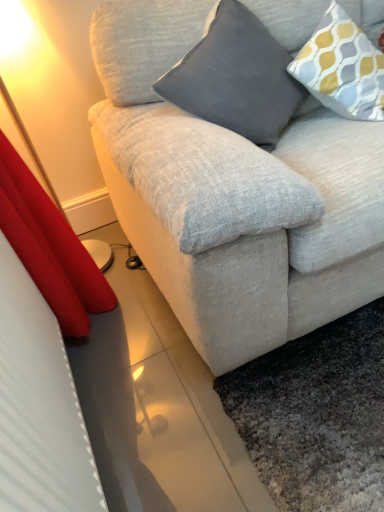
This screenshot has height=512, width=384. What do you see at coordinates (236, 77) in the screenshot?
I see `gray fabric pillow at upper center, which is the 2th pillow in right-to-left order` at bounding box center [236, 77].

Find the location of a particular element. The width and height of the screenshot is (384, 512). gray fabric pillow at upper center, positioned as the 1th pillow in left-to-right order is located at coordinates (236, 77).

In order to face gray fabric pillow at upper center, which is the 2th pillow in right-to-left order, should I rotate leftwards or rightwards?

It's best to rotate right around 5.206 degrees.

What is the approximate height of patterned fabric pillow at upper right, the 2th pillow positioned from the left?

patterned fabric pillow at upper right, the 2th pillow positioned from the left, is 16.42 inches tall.

The width and height of the screenshot is (384, 512). Describe the element at coordinates (342, 68) in the screenshot. I see `patterned fabric pillow at upper right, the 2th pillow positioned from the left` at that location.

What is the approximate width of patterned fabric pillow at upper right, the 2th pillow positioned from the left?

patterned fabric pillow at upper right, the 2th pillow positioned from the left, is 14.54 inches wide.

Locate an element on the screen. patterned fabric pillow at upper right, the 1th pillow positioned from the right is located at coordinates (342, 68).

The height and width of the screenshot is (512, 384). Identify the location of gray fabric pillow at upper center, which is the 2th pillow in right-to-left order. (236, 77).

Considering the positions of objects patterned fabric pillow at upper right, the 2th pillow positioned from the left, and gray fabric pillow at upper center, which is the 2th pillow in right-to-left order, in the image provided, who is more to the left, patterned fabric pillow at upper right, the 2th pillow positioned from the left, or gray fabric pillow at upper center, which is the 2th pillow in right-to-left order,?

Positioned to the left is gray fabric pillow at upper center, which is the 2th pillow in right-to-left order.

Looking at this image, between patterned fabric pillow at upper right, the 2th pillow positioned from the left, and gray fabric pillow at upper center, which is the 2th pillow in right-to-left order, which one is positioned in front?

gray fabric pillow at upper center, which is the 2th pillow in right-to-left order, is more forward.

Which is nearer, (x=333, y=39) or (x=285, y=59)?

Point (x=333, y=39)

From the image's perspective, which is above, patterned fabric pillow at upper right, the 2th pillow positioned from the left, or gray fabric pillow at upper center, which is the 2th pillow in right-to-left order?

patterned fabric pillow at upper right, the 2th pillow positioned from the left, from the image's perspective.

From a real-world perspective, is patterned fabric pillow at upper right, the 1th pillow positioned from the right, on top of gray fabric pillow at upper center, positioned as the 1th pillow in left-to-right order?

Actually, patterned fabric pillow at upper right, the 1th pillow positioned from the right, is physically below gray fabric pillow at upper center, positioned as the 1th pillow in left-to-right order, in the real world.

Between patterned fabric pillow at upper right, the 2th pillow positioned from the left, and gray fabric pillow at upper center, which is the 2th pillow in right-to-left order, which one has larger width?

gray fabric pillow at upper center, which is the 2th pillow in right-to-left order, is wider.

Considering the sizes of objects patterned fabric pillow at upper right, the 2th pillow positioned from the left, and gray fabric pillow at upper center, positioned as the 1th pillow in left-to-right order, in the image provided, who is taller, patterned fabric pillow at upper right, the 2th pillow positioned from the left, or gray fabric pillow at upper center, positioned as the 1th pillow in left-to-right order,?

Standing taller between the two is gray fabric pillow at upper center, positioned as the 1th pillow in left-to-right order.

Considering the sizes of objects patterned fabric pillow at upper right, the 1th pillow positioned from the right, and gray fabric pillow at upper center, positioned as the 1th pillow in left-to-right order, in the image provided, who is bigger, patterned fabric pillow at upper right, the 1th pillow positioned from the right, or gray fabric pillow at upper center, positioned as the 1th pillow in left-to-right order,?

Bigger between the two is gray fabric pillow at upper center, positioned as the 1th pillow in left-to-right order.

Is gray fabric pillow at upper center, which is the 2th pillow in right-to-left order, completely or partially inside patterned fabric pillow at upper right, the 2th pillow positioned from the left?

No, gray fabric pillow at upper center, which is the 2th pillow in right-to-left order, is not surrounded by patterned fabric pillow at upper right, the 2th pillow positioned from the left.

Are patterned fabric pillow at upper right, the 1th pillow positioned from the right, and gray fabric pillow at upper center, positioned as the 1th pillow in left-to-right order, located far from each other?

No, patterned fabric pillow at upper right, the 1th pillow positioned from the right, is not far from gray fabric pillow at upper center, positioned as the 1th pillow in left-to-right order.

Is patterned fabric pillow at upper right, the 2th pillow positioned from the left, turned away from gray fabric pillow at upper center, positioned as the 1th pillow in left-to-right order?

That's not correct — patterned fabric pillow at upper right, the 2th pillow positioned from the left, is not looking away from gray fabric pillow at upper center, positioned as the 1th pillow in left-to-right order.

Find the location of `pillow that appears on the right of gray fabric pillow at upper center, positioned as the 1th pillow in left-to-right order`. pillow that appears on the right of gray fabric pillow at upper center, positioned as the 1th pillow in left-to-right order is located at coordinates (342, 68).

In the image, is gray fabric pillow at upper center, which is the 2th pillow in right-to-left order, on the left side or the right side of patterned fabric pillow at upper right, the 1th pillow positioned from the right?

Clearly, gray fabric pillow at upper center, which is the 2th pillow in right-to-left order, is on the left of patterned fabric pillow at upper right, the 1th pillow positioned from the right, in the image.

Is gray fabric pillow at upper center, which is the 2th pillow in right-to-left order, closer to the viewer compared to patterned fabric pillow at upper right, the 2th pillow positioned from the left?

Yes, it is.

Between point (277, 105) and point (383, 83), which one is positioned behind?

The point (383, 83) is more distant.

From the image's perspective, is gray fabric pillow at upper center, which is the 2th pillow in right-to-left order, located above patterned fabric pillow at upper right, the 1th pillow positioned from the right?

No, from the image's perspective, gray fabric pillow at upper center, which is the 2th pillow in right-to-left order, is not over patterned fabric pillow at upper right, the 1th pillow positioned from the right.

Looking at this image, from a real-world perspective, which is physically below, gray fabric pillow at upper center, which is the 2th pillow in right-to-left order, or patterned fabric pillow at upper right, the 1th pillow positioned from the right?

patterned fabric pillow at upper right, the 1th pillow positioned from the right, is physically lower.

Considering the sizes of objects gray fabric pillow at upper center, positioned as the 1th pillow in left-to-right order, and patterned fabric pillow at upper right, the 2th pillow positioned from the left, in the image provided, who is wider, gray fabric pillow at upper center, positioned as the 1th pillow in left-to-right order, or patterned fabric pillow at upper right, the 2th pillow positioned from the left,?

gray fabric pillow at upper center, positioned as the 1th pillow in left-to-right order.

Between gray fabric pillow at upper center, which is the 2th pillow in right-to-left order, and patterned fabric pillow at upper right, the 2th pillow positioned from the left, which one has less height?

patterned fabric pillow at upper right, the 2th pillow positioned from the left.

Does gray fabric pillow at upper center, which is the 2th pillow in right-to-left order, have a smaller size compared to patterned fabric pillow at upper right, the 1th pillow positioned from the right?

Incorrect, gray fabric pillow at upper center, which is the 2th pillow in right-to-left order, is not smaller in size than patterned fabric pillow at upper right, the 1th pillow positioned from the right.

Is gray fabric pillow at upper center, positioned as the 1th pillow in left-to-right order, completely or partially outside of patterned fabric pillow at upper right, the 1th pillow positioned from the right?

gray fabric pillow at upper center, positioned as the 1th pillow in left-to-right order, is positioned outside patterned fabric pillow at upper right, the 1th pillow positioned from the right.

Can you see gray fabric pillow at upper center, positioned as the 1th pillow in left-to-right order, touching patterned fabric pillow at upper right, the 2th pillow positioned from the left?

Answer: They are not placed beside each other.

Does gray fabric pillow at upper center, which is the 2th pillow in right-to-left order, turn towards patterned fabric pillow at upper right, the 1th pillow positioned from the right?

No.

What's the angular difference between gray fabric pillow at upper center, which is the 2th pillow in right-to-left order, and patterned fabric pillow at upper right, the 1th pillow positioned from the right,'s facing directions?

The angle between the facing direction of gray fabric pillow at upper center, which is the 2th pillow in right-to-left order, and the facing direction of patterned fabric pillow at upper right, the 1th pillow positioned from the right, is 0.000939 degrees.

Measure the distance between gray fabric pillow at upper center, positioned as the 1th pillow in left-to-right order, and patterned fabric pillow at upper right, the 2th pillow positioned from the left.

gray fabric pillow at upper center, positioned as the 1th pillow in left-to-right order, is 7.75 inches from patterned fabric pillow at upper right, the 2th pillow positioned from the left.

The width and height of the screenshot is (384, 512). Find the location of `pillow lying behind the gray fabric pillow at upper center, which is the 2th pillow in right-to-left order`. pillow lying behind the gray fabric pillow at upper center, which is the 2th pillow in right-to-left order is located at coordinates (342, 68).

Identify the location of pillow lying on the left of patterned fabric pillow at upper right, the 1th pillow positioned from the right. Image resolution: width=384 pixels, height=512 pixels. (236, 77).

At what (x,y) coordinates should I click in order to perform the action: click on pillow directly beneath the gray fabric pillow at upper center, which is the 2th pillow in right-to-left order (from a real-world perspective). Please return your answer as a coordinate pair (x, y). The width and height of the screenshot is (384, 512). Looking at the image, I should click on [342, 68].